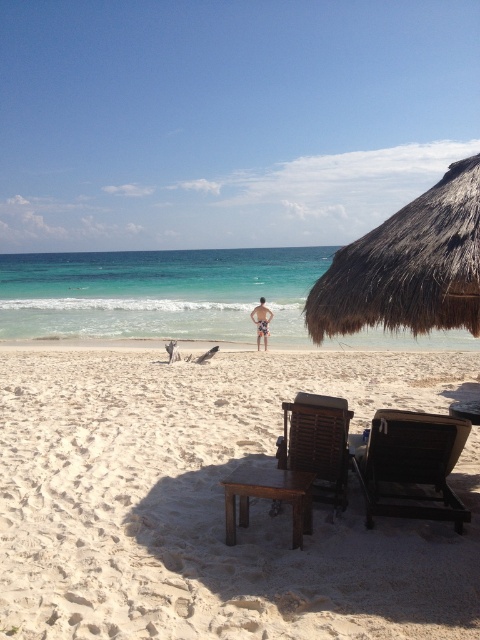
Question: Is white sandy beach at center below printed fabric shorts at center?

Choices:
 (A) yes
 (B) no

Answer: (A)

Question: Based on their relative distances, which object is farther from the white sandy beach at center?

Choices:
 (A) brown thatch umbrella at upper right
 (B) brown wooden beach chair at center
 (C) brown wooden stool at center

Answer: (A)

Question: Is brown thatch umbrella at upper right behind brown wooden beach chair at center?

Choices:
 (A) no
 (B) yes

Answer: (A)

Question: Is white sandy beach at center to the right of brown wooden stool at center from the viewer's perspective?

Choices:
 (A) yes
 (B) no

Answer: (A)

Question: Among these objects, which one is farthest from the camera?

Choices:
 (A) brown wooden stool at center
 (B) printed fabric shorts at center
 (C) white sandy beach at center

Answer: (B)

Question: Which object is farther from the camera taking this photo?

Choices:
 (A) white sandy beach at center
 (B) brown wooden stool at center
 (C) black plastic beach chair at lower right
 (D) printed fabric shorts at center

Answer: (D)